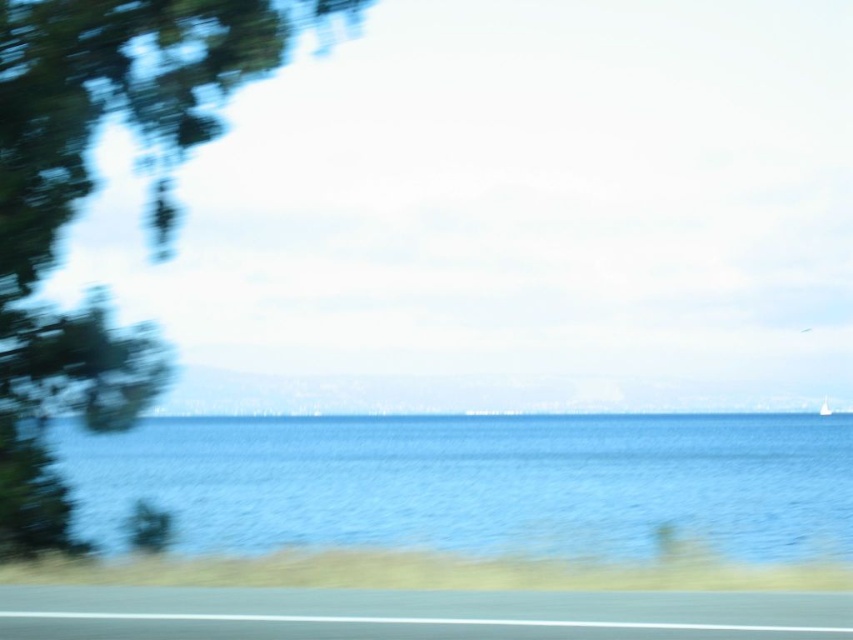
Question: Estimate the real-world distances between objects in this image. Which object is farther from the blue water at center?

Choices:
 (A) smooth asphalt highway at lower center
 (B) green matte tree at left

Answer: (A)

Question: Which of the following is the closest to the observer?

Choices:
 (A) smooth asphalt highway at lower center
 (B) green matte tree at left
 (C) blue water at center

Answer: (A)

Question: Which point appears closest to the camera in this image?

Choices:
 (A) [619, 536]
 (B) [10, 356]
 (C) [519, 620]

Answer: (C)

Question: Does blue water at center appear over smooth asphalt highway at lower center?

Choices:
 (A) no
 (B) yes

Answer: (A)

Question: Does blue water at center appear under green matte tree at left?

Choices:
 (A) no
 (B) yes

Answer: (B)

Question: Is blue water at center below green matte tree at left?

Choices:
 (A) yes
 (B) no

Answer: (A)